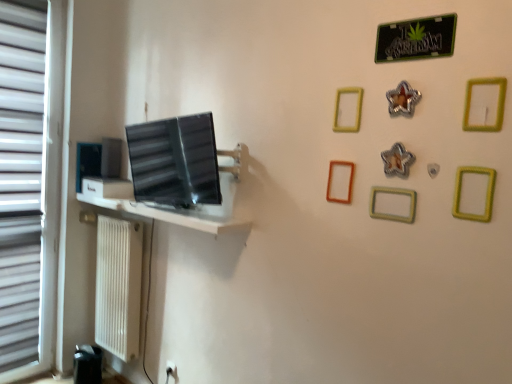
Question: Is white plastic blind at left taller than metallic star at upper center, arranged as the fifth picture frame when viewed from the left?

Choices:
 (A) yes
 (B) no

Answer: (A)

Question: Can metallic star at upper center, arranged as the 5th picture frame when viewed from the back, be found inside white plastic blind at left?

Choices:
 (A) no
 (B) yes

Answer: (A)

Question: Is white plastic blind at left bigger than metallic star at upper center, arranged as the fifth picture frame when viewed from the left?

Choices:
 (A) yes
 (B) no

Answer: (A)

Question: Is white plastic blind at left to the right of metallic star at upper center, arranged as the 5th picture frame when viewed from the back, from the viewer's perspective?

Choices:
 (A) yes
 (B) no

Answer: (B)

Question: Considering the relative positions of white plastic blind at left and metallic star at upper center, arranged as the 5th picture frame when viewed from the back, in the image provided, is white plastic blind at left in front of metallic star at upper center, arranged as the 5th picture frame when viewed from the back,?

Choices:
 (A) no
 (B) yes

Answer: (A)

Question: From the image's perspective, is green matte picture frame at center-right, the fifth picture frame from the right, positioned above or below satin black monitor at center?

Choices:
 (A) below
 (B) above

Answer: (A)

Question: Which is correct: green matte picture frame at center-right, which is the fifth picture frame in front-to-back order, is inside satin black monitor at center, or outside of it?

Choices:
 (A) outside
 (B) inside

Answer: (A)

Question: Is point (372, 208) positioned closer to the camera than point (169, 185)?

Choices:
 (A) farther
 (B) closer

Answer: (B)

Question: Based on their sizes in the image, would you say green matte picture frame at center-right, the fifth picture frame from the right, is bigger or smaller than satin black monitor at center?

Choices:
 (A) small
 (B) big

Answer: (A)

Question: Which is correct: green metallic sign at upper right is inside green matte picture frame at upper right, placed as the 1th picture frame when sorted from right to left, or outside of it?

Choices:
 (A) inside
 (B) outside

Answer: (B)

Question: Considering the positions of point (406, 46) and point (467, 94), is point (406, 46) closer or farther from the camera than point (467, 94)?

Choices:
 (A) closer
 (B) farther

Answer: (B)

Question: In terms of width, does green metallic sign at upper right look wider or thinner when compared to green matte picture frame at upper right, which is the first picture frame in front-to-back order?

Choices:
 (A) thin
 (B) wide

Answer: (A)

Question: From their relative heights in the image, would you say green metallic sign at upper right is taller or shorter than green matte picture frame at upper right, marked as the 8th picture frame in a left-to-right arrangement?

Choices:
 (A) short
 (B) tall

Answer: (A)

Question: From the image's perspective, is white textured radiator at lower left above or below white plastic blind at left?

Choices:
 (A) below
 (B) above

Answer: (A)

Question: In terms of size, does white textured radiator at lower left appear bigger or smaller than white plastic blind at left?

Choices:
 (A) big
 (B) small

Answer: (A)